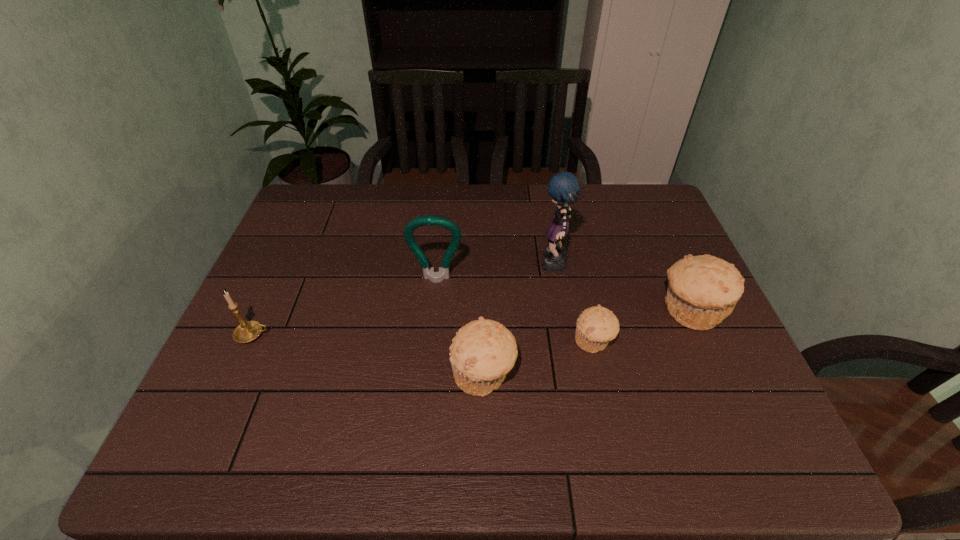
The height and width of the screenshot is (540, 960). Find the location of `unoccupied area between the rag doll and the rightmost muffin`. unoccupied area between the rag doll and the rightmost muffin is located at coordinates [x=623, y=288].

Find the location of a particular element. The width and height of the screenshot is (960, 540). object that stands as the third closest to the second muffin from left to right is located at coordinates (563, 187).

Locate which object is the fourth closest to the second tallest muffin. Please provide its 2D coordinates. Your answer should be formatted as a tuple, i.e. [(x, y)], where the tuple contains the x and y coordinates of a point satisfying the conditions above.

[(703, 290)]

Where is `the second closest muffin to the shortest muffin`? The image size is (960, 540). the second closest muffin to the shortest muffin is located at coordinates (483, 351).

Choose which muffin is the second nearest neighbor to the tallest object. Please provide its 2D coordinates. Your answer should be formatted as a tuple, i.e. [(x, y)], where the tuple contains the x and y coordinates of a point satisfying the conditions above.

[(703, 290)]

At what (x,y) coordinates should I click in order to perform the action: click on free space that satisfies the following two spatial constraints: 1. on the front-facing side of the rag doll; 2. at the jaws of the fifth shortest object. Please return your answer as a coordinate pair (x, y). Looking at the image, I should click on (558, 280).

You are a GUI agent. You are given a task and a screenshot of the screen. Output one action in this format:
    pyautogui.click(x=<x>, y=<y>)
    Task: Click on the free space that satisfies the following two spatial constraints: 1. on the front-facing side of the tallest object; 2. on the back side of the rightmost muffin
    
    Given the screenshot: What is the action you would take?
    pyautogui.click(x=564, y=312)

The image size is (960, 540). Find the location of `free location that satisfies the following two spatial constraints: 1. at the jaws of the fifth shortest object; 2. on the left side of the second tallest muffin`. free location that satisfies the following two spatial constraints: 1. at the jaws of the fifth shortest object; 2. on the left side of the second tallest muffin is located at coordinates (427, 375).

Locate an element on the screen. This screenshot has height=540, width=960. vacant space that satisfies the following two spatial constraints: 1. on the front-facing side of the tallest object; 2. on the back side of the second muffin from left to right is located at coordinates (568, 341).

Where is `free spot that satisfies the following two spatial constraints: 1. at the jaws of the second muffin from right to left; 2. on the right side of the fifth shortest object`? This screenshot has width=960, height=540. free spot that satisfies the following two spatial constraints: 1. at the jaws of the second muffin from right to left; 2. on the right side of the fifth shortest object is located at coordinates (430, 341).